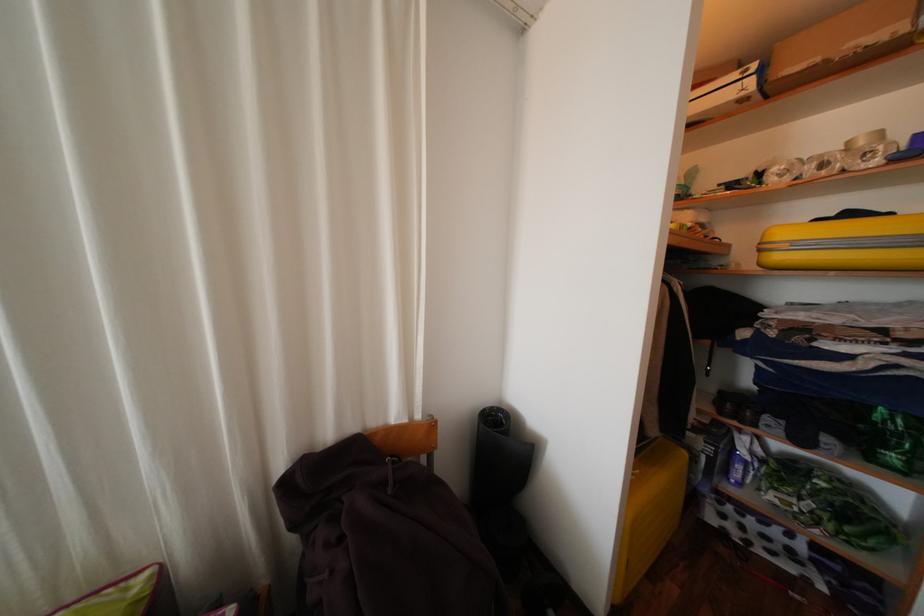
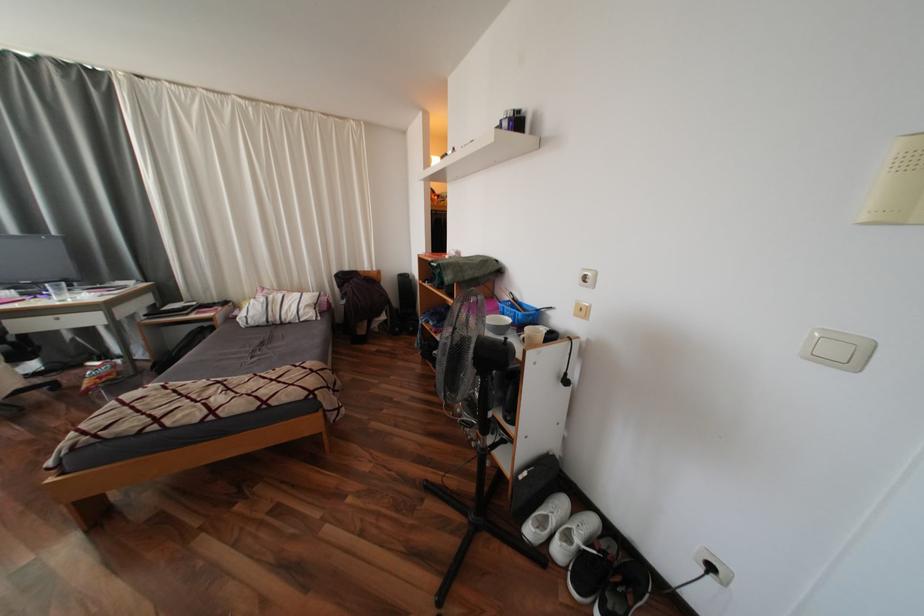
What movement of the cameraman would produce the second image?

The cameraman walked toward right, backward.